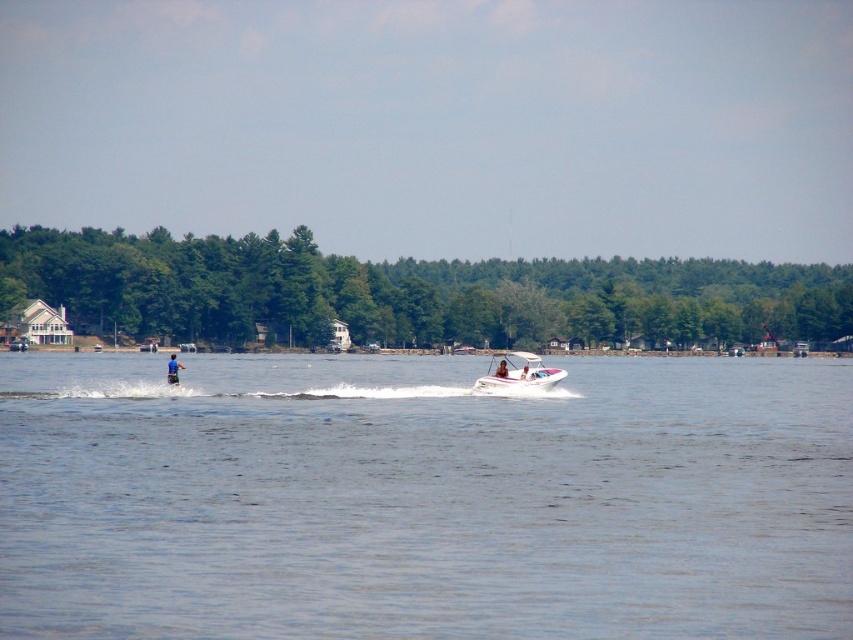
Is white plastic boat at center bigger than blue fabric person at center?

Yes.

Is point (521, 387) positioned before point (503, 362)?

Yes, point (521, 387) is in front of point (503, 362).

Where is `white plastic boat at center`? white plastic boat at center is located at coordinates (518, 372).

Is blue fabric at center to the right of blue fabric person at center from the viewer's perspective?

Incorrect, blue fabric at center is not on the right side of blue fabric person at center.

Which of these two, blue fabric at center or blue fabric person at center, stands taller?

blue fabric at center is taller.

At what (x,y) coordinates should I click in order to perform the action: click on blue fabric at center. Please return your answer as a coordinate pair (x, y). This screenshot has width=853, height=640. Looking at the image, I should click on (173, 369).

Is clear blue water at center shorter than blue fabric at center?

No.

How distant is clear blue water at center from blue fabric at center?

clear blue water at center and blue fabric at center are 24.69 meters apart.

Identify the location of clear blue water at center. This screenshot has width=853, height=640. (424, 499).

The image size is (853, 640). Identify the location of clear blue water at center. (424, 499).